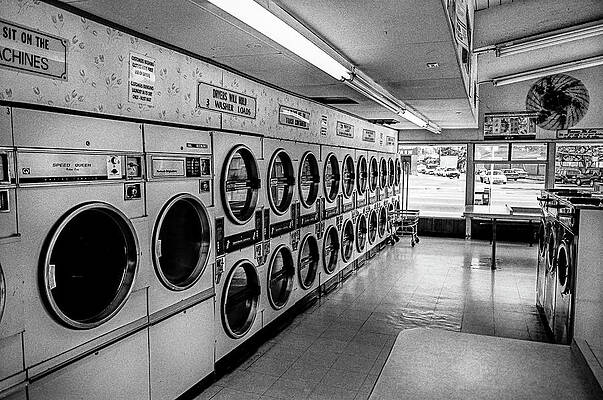
You are a GUI agent. You are given a task and a screenshot of the screen. Output one action in this format:
    pyautogui.click(x=<x>, y=<y>)
    Task: Click on the table
    This screenshot has height=400, width=603.
    Given the screenshot: What is the action you would take?
    pyautogui.click(x=453, y=386)